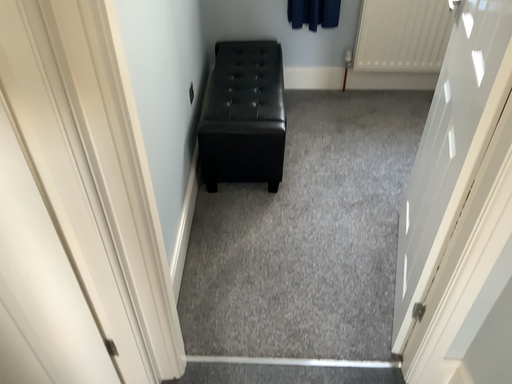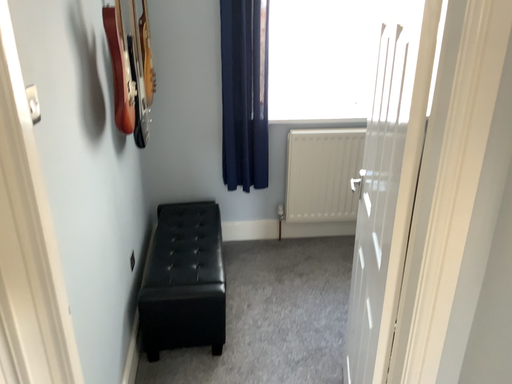
Question: Which way did the camera rotate in the video?

Choices:
 (A) rotated downward
 (B) rotated upward

Answer: (B)